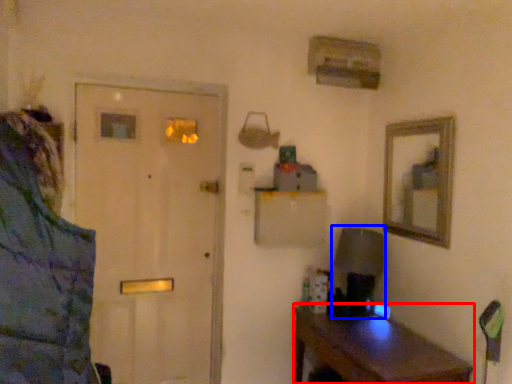
Question: Among these objects, which one is nearest to the camera, desk (highlighted by a red box) or table lamp (highlighted by a blue box)?

Choices:
 (A) desk
 (B) table lamp

Answer: (A)